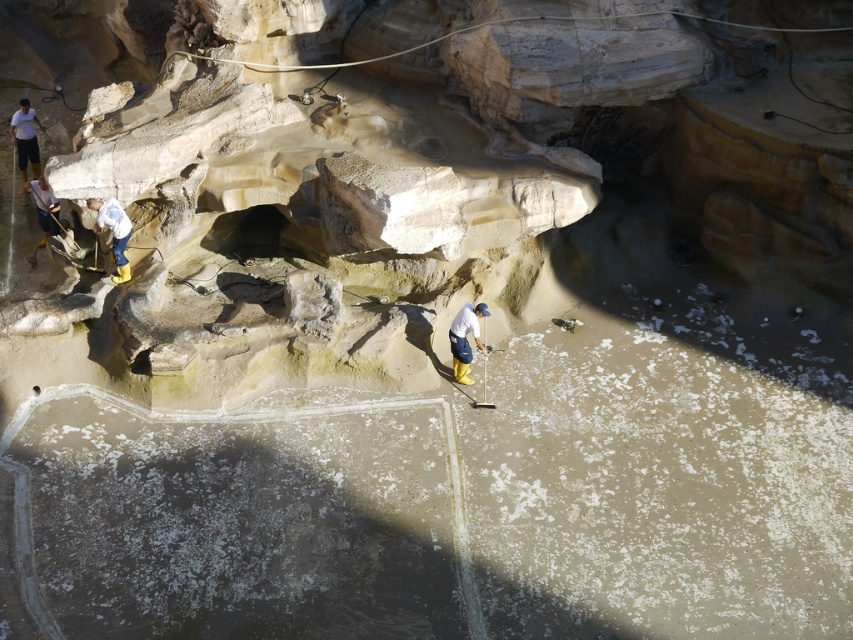
Between white fabric at left and white matte helmet at upper left, which one is positioned higher?

Positioned higher is white matte helmet at upper left.

I want to click on white fabric at left, so click(x=113, y=232).

Who is shorter, white matte shirt at upper left or white matte helmet at upper left?

white matte helmet at upper left is shorter.

This screenshot has width=853, height=640. Describe the element at coordinates (25, 138) in the screenshot. I see `white matte shirt at upper left` at that location.

This screenshot has width=853, height=640. I want to click on white matte shirt at upper left, so click(25, 138).

Between white matte shirt at center and white matte helmet at upper left, which one is positioned higher?

Positioned higher is white matte helmet at upper left.

Which is behind, point (466, 378) or point (39, 211)?

Point (39, 211)

You are a GUI agent. You are given a task and a screenshot of the screen. Output one action in this format:
    pyautogui.click(x=<x>, y=<y>)
    Task: Click on the white matte shirt at center
    The image size is (853, 640).
    Given the screenshot: What is the action you would take?
    pyautogui.click(x=465, y=339)